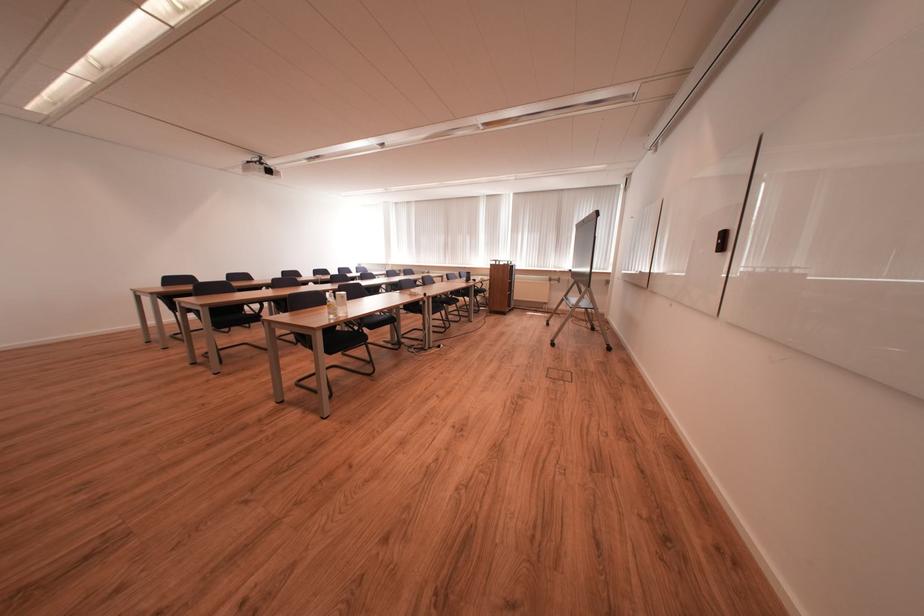
Locate an element on the screen. This screenshot has height=616, width=924. white dispenser bottle is located at coordinates (331, 305).